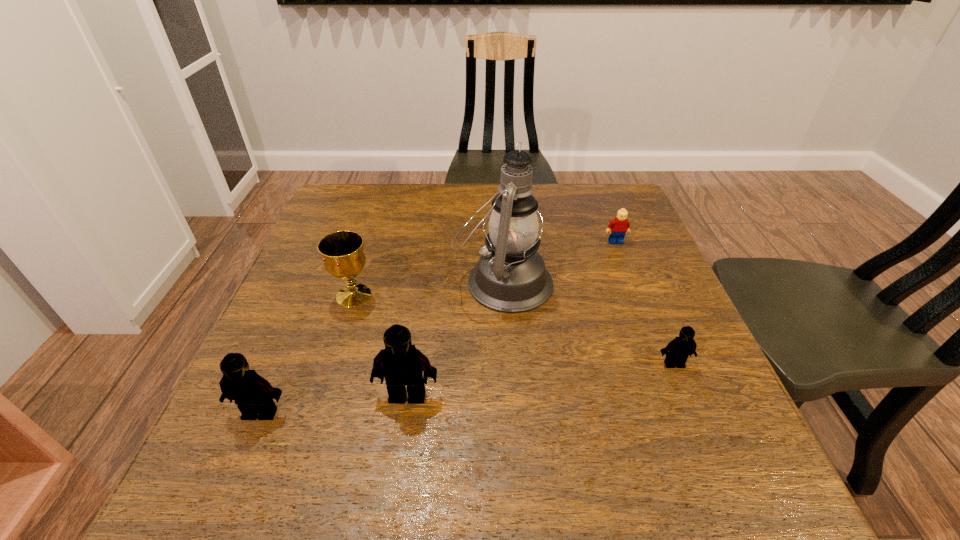
Locate an element on the screen. The image size is (960, 540). the leftmost object is located at coordinates (253, 395).

Locate an element on the screen. The width and height of the screenshot is (960, 540). the third shortest Lego is located at coordinates (253, 395).

Identify the location of the second Lego from left to right. (400, 363).

Locate an element on the screen. This screenshot has width=960, height=540. the second farthest Lego is located at coordinates (680, 348).

You are a GUI agent. You are given a task and a screenshot of the screen. Output one action in this format:
    pyautogui.click(x=<x>, y=<y>)
    Task: Click on the chalice
    The image size is (960, 540).
    Given the screenshot: What is the action you would take?
    pyautogui.click(x=342, y=251)

This screenshot has width=960, height=540. In order to click on the fourth object from left to right in this screenshot , I will do `click(510, 277)`.

This screenshot has height=540, width=960. Find the location of `the tallest object`. the tallest object is located at coordinates (510, 277).

Find the location of `the farthest Lego`. the farthest Lego is located at coordinates (620, 225).

At what (x,y) coordinates should I click in order to perform the action: click on vacant space situated 0.050m on the face of the third Lego from right to left. Please return your answer as a coordinate pair (x, y). This screenshot has width=960, height=540. Looking at the image, I should click on (402, 432).

The width and height of the screenshot is (960, 540). Find the location of `vacant space located on the face of the second farthest Lego`. vacant space located on the face of the second farthest Lego is located at coordinates (695, 416).